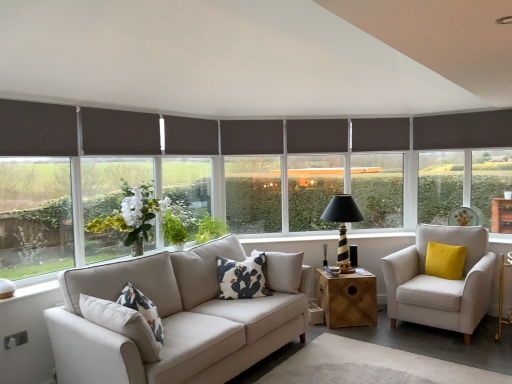
Question: From a real-world perspective, is white cotton cushion at center, the 2th pillow positioned from the right, physically below dark gray roller blind at left, positioned as the second window screen in right-to-left order?

Choices:
 (A) yes
 (B) no

Answer: (A)

Question: Is white cotton cushion at center, the 2th pillow positioned from the right, in front of dark gray roller blind at left, which is the second window screen in back-to-front order?

Choices:
 (A) yes
 (B) no

Answer: (B)

Question: Considering the relative positions of white cotton cushion at center, acting as the 1th pillow starting from the front, and dark gray roller blind at left, which is the second window screen in back-to-front order, in the image provided, is white cotton cushion at center, acting as the 1th pillow starting from the front, to the right of dark gray roller blind at left, which is the second window screen in back-to-front order, from the viewer's perspective?

Choices:
 (A) no
 (B) yes

Answer: (B)

Question: From a real-world perspective, is white cotton cushion at center, the 2th pillow positioned from the right, positioned over dark gray roller blind at left, the first window screen viewed from the left, based on gravity?

Choices:
 (A) no
 (B) yes

Answer: (A)

Question: Can you confirm if white cotton cushion at center, acting as the first pillow starting from the left, is positioned to the left of dark gray roller blind at left, the first window screen viewed from the left?

Choices:
 (A) yes
 (B) no

Answer: (B)

Question: Based on their positions, is yellow velvet pillow at right, which is the first pillow in back-to-front order, located to the left or right of black striped wood table lamp at center?

Choices:
 (A) left
 (B) right

Answer: (B)

Question: From the image's perspective, relative to black striped wood table lamp at center, is yellow velvet pillow at right, the first pillow viewed from the right, above or below?

Choices:
 (A) below
 (B) above

Answer: (A)

Question: From a real-world perspective, relative to black striped wood table lamp at center, is yellow velvet pillow at right, which is the first pillow in back-to-front order, vertically above or below?

Choices:
 (A) below
 (B) above

Answer: (A)

Question: Is yellow velvet pillow at right, which is counted as the second pillow, starting from the front, taller or shorter than black striped wood table lamp at center?

Choices:
 (A) tall
 (B) short

Answer: (B)

Question: From a real-world perspective, is yellow velvet pillow at right, the first pillow viewed from the right, physically located above or below dark gray roller blind at left, the 1th window screen viewed from the front?

Choices:
 (A) above
 (B) below

Answer: (B)

Question: Is point [x=429, y=271] closer or farther from the camera than point [x=53, y=251]?

Choices:
 (A) farther
 (B) closer

Answer: (A)

Question: Based on their positions, is yellow velvet pillow at right, which is counted as the second pillow, starting from the front, located to the left or right of dark gray roller blind at left, the first window screen viewed from the left?

Choices:
 (A) right
 (B) left

Answer: (A)

Question: In the image, is yellow velvet pillow at right, the first pillow viewed from the right, positioned in front of or behind dark gray roller blind at left, which is the second window screen in back-to-front order?

Choices:
 (A) behind
 (B) front

Answer: (A)

Question: Based on their sizes in the image, would you say black striped wood table lamp at center is bigger or smaller than light beige fabric armchair at right?

Choices:
 (A) big
 (B) small

Answer: (B)

Question: From a real-world perspective, is black striped wood table lamp at center physically located above or below light beige fabric armchair at right?

Choices:
 (A) below
 (B) above

Answer: (B)